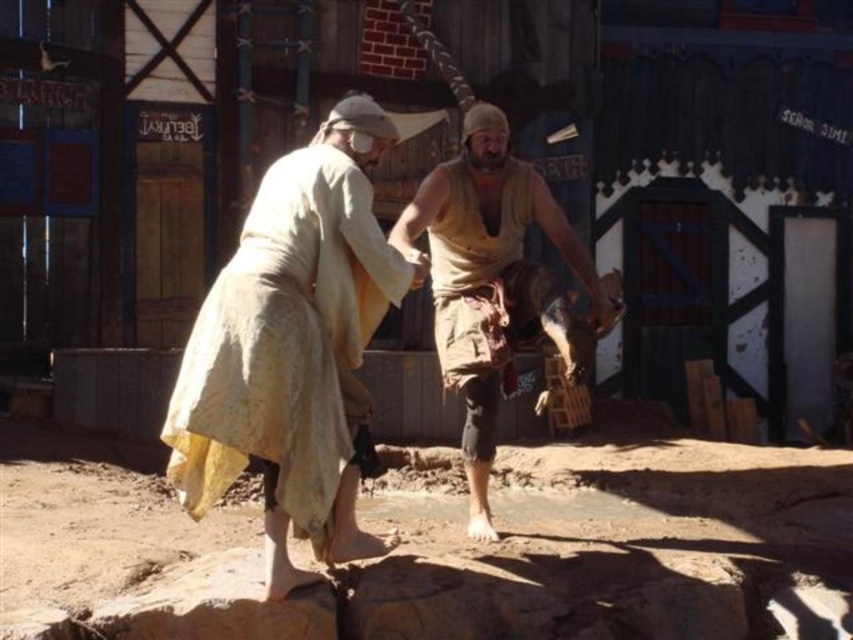
You are a photographer trying to capture the light beige fabric dress at center in the frame. If the camera has a focal point at coordinates 0.5, 0.3, will the dress be in focus?

The light beige fabric dress at center is located at point (293, 348), which is close to the focal point of (254, 320). Therefore, the dress will likely be in focus.